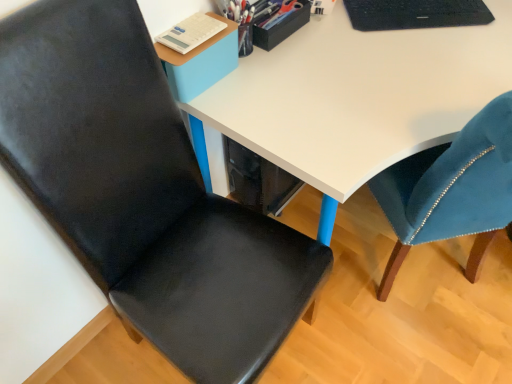
Locate an element on the screen. The height and width of the screenshot is (384, 512). vacant space in between black textured laptop at upper right and metallic pen holder at upper center is located at coordinates (347, 35).